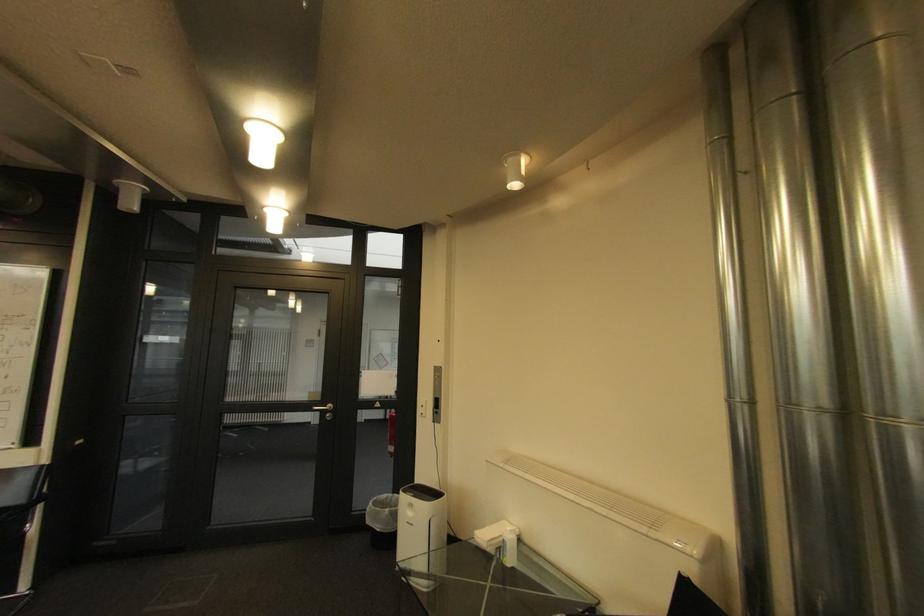
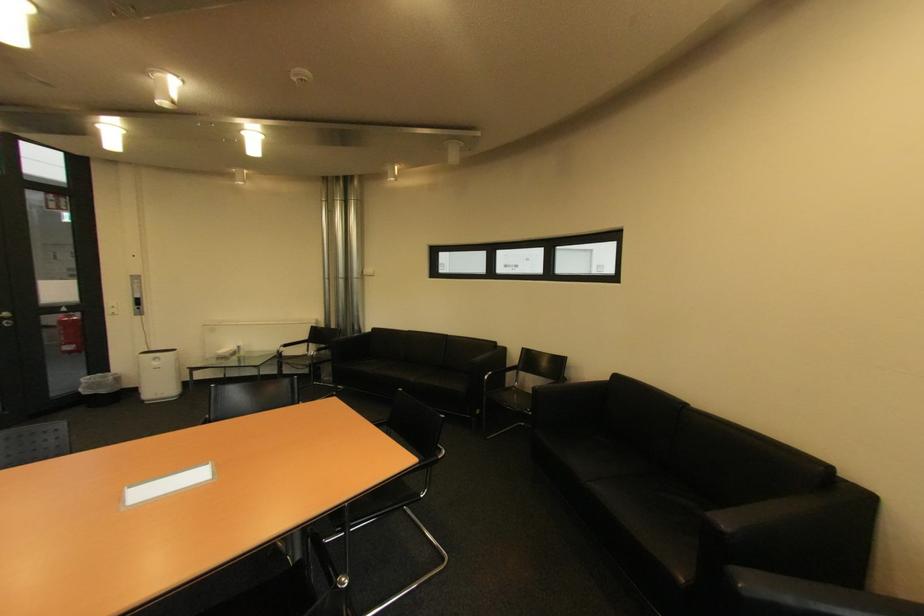
Locate, in the second image, the point that corresponds to pixel 377 523 in the first image.

(94, 394)